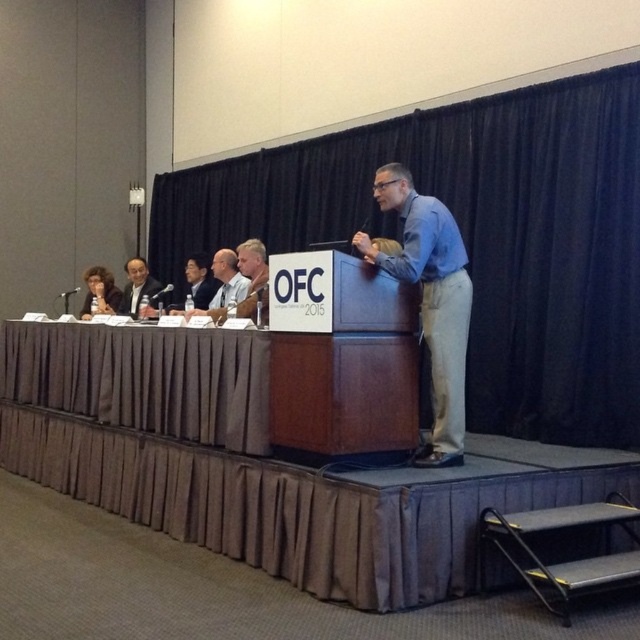
You are standing at the point labeled point (132, 266) in the image. If you want to move towards the point labeled point (241, 387), which direction should you move in relation to the stage?

You should move forward because point (241, 387) is in front of point (132, 266), meaning it is closer to the stage.